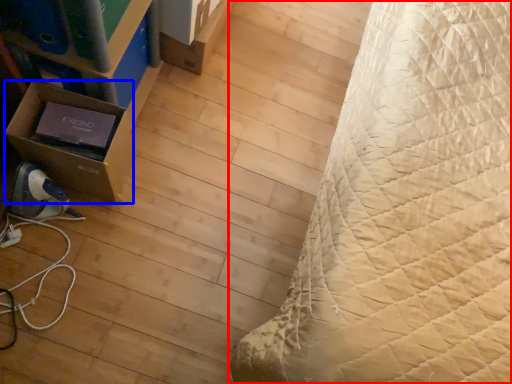
Question: Which object is further to the camera taking this photo, bed (highlighted by a red box) or cardboard box (highlighted by a blue box)?

Choices:
 (A) bed
 (B) cardboard box

Answer: (B)